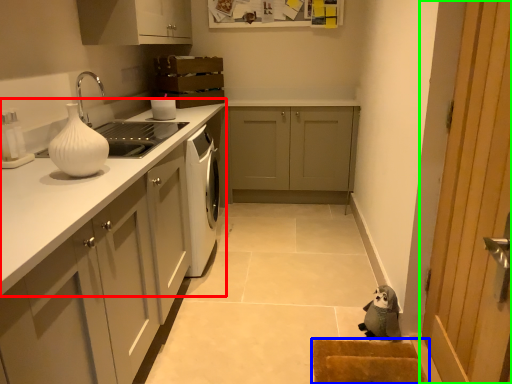
Question: Which object is positioned closest to countertop (highlighted by a red box)? Select from doormat (highlighted by a blue box) and door (highlighted by a green box).

Choices:
 (A) doormat
 (B) door

Answer: (A)